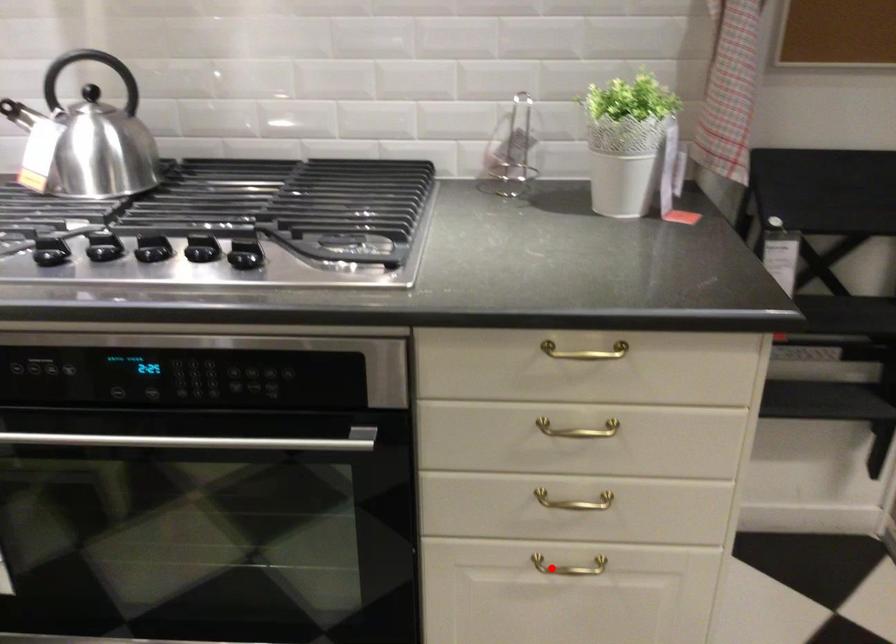
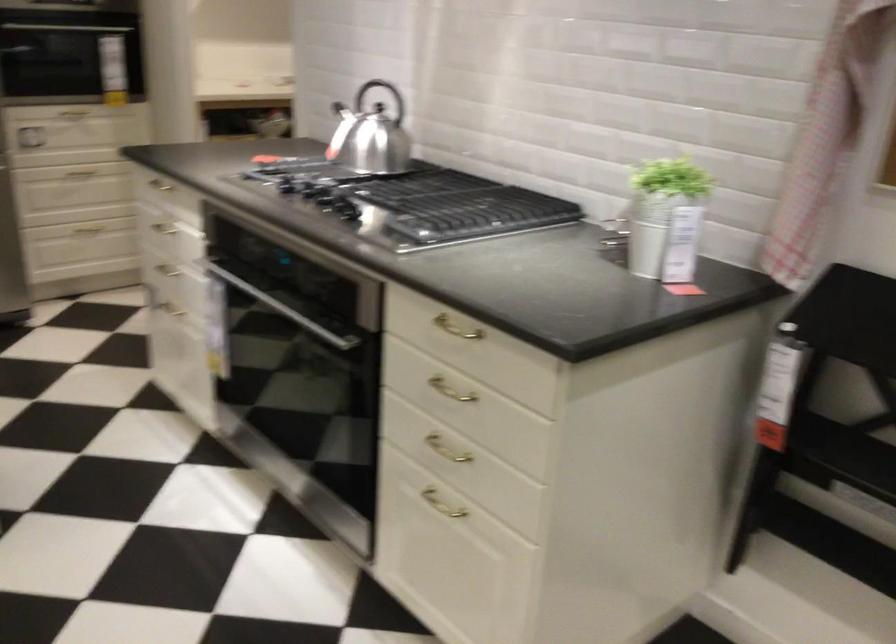
Question: I am providing you with two images of the same scene from different viewpoints. Given a red point in image1, look at the same physical point in image2. Is it:

Choices:
 (A) Closer to the viewpoint
 (B) Farther from the viewpoint

Answer: (B)